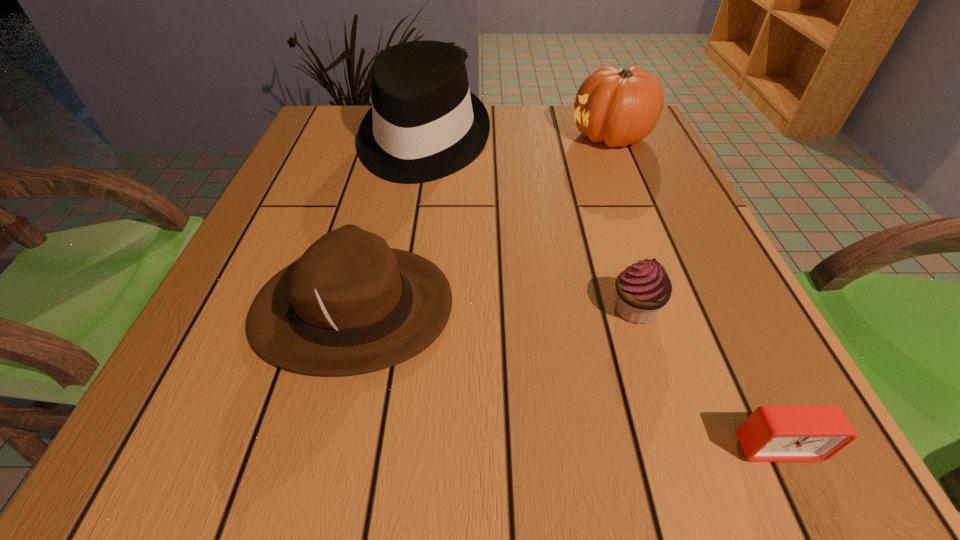
Find the location of `object that is at the near right corner`. object that is at the near right corner is located at coordinates (772, 433).

In order to click on vacant space at the far edge of the desktop in this screenshot , I will do `click(515, 144)`.

In the image, there is a desktop. Identify the location of vacant area at the near edge. click(x=510, y=418).

Where is `vacant space at the left edge`? vacant space at the left edge is located at coordinates (204, 339).

Locate an element on the screen. vacant space at the right edge of the desktop is located at coordinates (595, 156).

At what (x,y) coordinates should I click in order to perform the action: click on vacant space at the far left corner of the desktop. Please return your answer as a coordinate pair (x, y). Looking at the image, I should click on (334, 115).

The width and height of the screenshot is (960, 540). Find the location of `free spot between the cupcake and the taller fedora`. free spot between the cupcake and the taller fedora is located at coordinates (529, 225).

Identify the location of free space between the nearer fedora and the second shortest object. (494, 308).

Identify the location of free space between the pumpkin and the taller fedora. Image resolution: width=960 pixels, height=540 pixels. (517, 139).

This screenshot has width=960, height=540. Find the location of `free space between the taller fedora and the pumpkin`. free space between the taller fedora and the pumpkin is located at coordinates (517, 139).